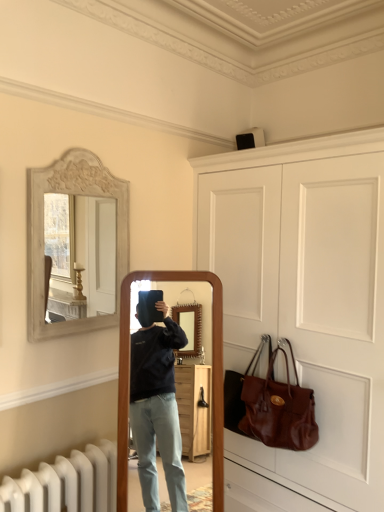
Image resolution: width=384 pixels, height=512 pixels. What are the coordinates of `brown leather handbag at lower right` in the screenshot? It's located at click(x=278, y=408).

Where is `white matte door at upper center`? The width and height of the screenshot is (384, 512). white matte door at upper center is located at coordinates (304, 302).

This screenshot has width=384, height=512. I want to click on white carved wood mirror at upper left, so click(43, 232).

The height and width of the screenshot is (512, 384). I want to click on brown leather handbag at lower right, so click(x=278, y=408).

From a real-world perspective, is brown leather handbag at lower right located beneath white matte door at upper center?

Correct, in the physical world, brown leather handbag at lower right is lower than white matte door at upper center.

Can you tell me how much brown leather handbag at lower right and white matte door at upper center differ in facing direction?

They differ by 0.0032 degrees in their facing directions.

Is white matte door at upper center at the back of brown leather handbag at lower right?

Yes, white matte door at upper center is at the back of brown leather handbag at lower right.

Which object is further away from the camera taking this photo, brown leather handbag at lower right or white matte door at upper center?

brown leather handbag at lower right is behind.

In the scene shown: Is the surface of white matte door at upper center in direct contact with brown leather handbag at lower right?

No.

In terms of size, does white matte door at upper center appear bigger or smaller than brown leather handbag at lower right?

white matte door at upper center is bigger than brown leather handbag at lower right.

This screenshot has width=384, height=512. Find the location of `door on the right of brown leather handbag at lower right`. door on the right of brown leather handbag at lower right is located at coordinates (304, 302).

In terms of width, does white matte door at upper center look wider or thinner when compared to brown leather handbag at lower right?

Considering their sizes, white matte door at upper center looks broader than brown leather handbag at lower right.

Is brown leather handbag at lower right inside the boundaries of white carved wood mirror at upper left, or outside?

brown leather handbag at lower right is outside white carved wood mirror at upper left.

From a real-world perspective, is brown leather handbag at lower right physically located above or below white carved wood mirror at upper left?

From a real-world perspective, brown leather handbag at lower right is physically below white carved wood mirror at upper left.

Considering the relative sizes of brown leather handbag at lower right and white carved wood mirror at upper left in the image provided, is brown leather handbag at lower right bigger than white carved wood mirror at upper left?

Indeed, brown leather handbag at lower right has a larger size compared to white carved wood mirror at upper left.

Does brown leather handbag at lower right turn towards white carved wood mirror at upper left?

No, brown leather handbag at lower right is not facing towards white carved wood mirror at upper left.

Considering the sizes of objects white carved wood mirror at upper left and white matte door at upper center in the image provided, who is smaller, white carved wood mirror at upper left or white matte door at upper center?

white carved wood mirror at upper left is smaller.

In the scene shown: Is white matte door at upper center surrounded by white carved wood mirror at upper left?

No, white matte door at upper center is not inside white carved wood mirror at upper left.

Looking at their sizes, would you say white carved wood mirror at upper left is wider or thinner than white matte door at upper center?

Considering their sizes, white carved wood mirror at upper left looks slimmer than white matte door at upper center.

At what (x,y) coordinates should I click in order to perform the action: click on door on the right of white carved wood mirror at upper left. Please return your answer as a coordinate pair (x, y). The image size is (384, 512). Looking at the image, I should click on (304, 302).

From the image's perspective, does white matte door at upper center appear lower than white carved wood mirror at upper left?

Indeed, from the image's perspective, white matte door at upper center is shown beneath white carved wood mirror at upper left.

Is white matte door at upper center situated inside white carved wood mirror at upper left or outside?

white matte door at upper center exists outside the volume of white carved wood mirror at upper left.

You are a GUI agent. You are given a task and a screenshot of the screen. Output one action in this format:
    pyautogui.click(x=<x>, y=<y>)
    Task: Click on the door on the right of white carved wood mirror at upper left
    
    Given the screenshot: What is the action you would take?
    pyautogui.click(x=304, y=302)

Are white matte door at upper center and white carved wood mirror at upper left beside each other?

No, white matte door at upper center is not touching white carved wood mirror at upper left.

Is white carved wood mirror at upper left positioned with its back to brown leather handbag at lower right?

No, brown leather handbag at lower right is not at the back of white carved wood mirror at upper left.

Is white carved wood mirror at upper left in front of or behind brown leather handbag at lower right in the image?

white carved wood mirror at upper left is in front of brown leather handbag at lower right.

This screenshot has height=512, width=384. In order to click on picture frame that appears above the brown leather handbag at lower right (from a real-world perspective) in this screenshot , I will do `click(43, 232)`.

Can you confirm if white carved wood mirror at upper left is smaller than brown leather handbag at lower right?

Correct, white carved wood mirror at upper left occupies less space than brown leather handbag at lower right.

At what (x,y) coordinates should I click in order to perform the action: click on door in front of the brown leather handbag at lower right. Please return your answer as a coordinate pair (x, y). This screenshot has width=384, height=512. Looking at the image, I should click on (304, 302).

This screenshot has height=512, width=384. What are the coordinates of `door above the brown leather handbag at lower right (from a real-world perspective)` in the screenshot? It's located at (304, 302).

From the image, which object appears to be nearer to white carved wood mirror at upper left, white matte door at upper center or brown leather handbag at lower right?

white matte door at upper center lies closer to white carved wood mirror at upper left than the other object.

Considering their positions, is brown leather handbag at lower right positioned closer to white carved wood mirror at upper left than white matte door at upper center?

Among the two, white matte door at upper center is located nearer to white carved wood mirror at upper left.

From the picture: Based on their spatial positions, is brown leather handbag at lower right or white carved wood mirror at upper left further from white matte door at upper center?

Based on the image, white carved wood mirror at upper left appears to be further to white matte door at upper center.

Looking at the image, which one is located closer to white matte door at upper center, white carved wood mirror at upper left or brown leather handbag at lower right?

Based on the image, brown leather handbag at lower right appears to be nearer to white matte door at upper center.

Looking at the image, which one is located further to brown leather handbag at lower right, white carved wood mirror at upper left or white matte door at upper center?

The object further to brown leather handbag at lower right is white carved wood mirror at upper left.

When comparing their distances from brown leather handbag at lower right, does white matte door at upper center or white carved wood mirror at upper left seem closer?

white matte door at upper center is closer to brown leather handbag at lower right.

Find the location of a particular element. handbag situated between white carved wood mirror at upper left and white matte door at upper center from left to right is located at coordinates (278, 408).